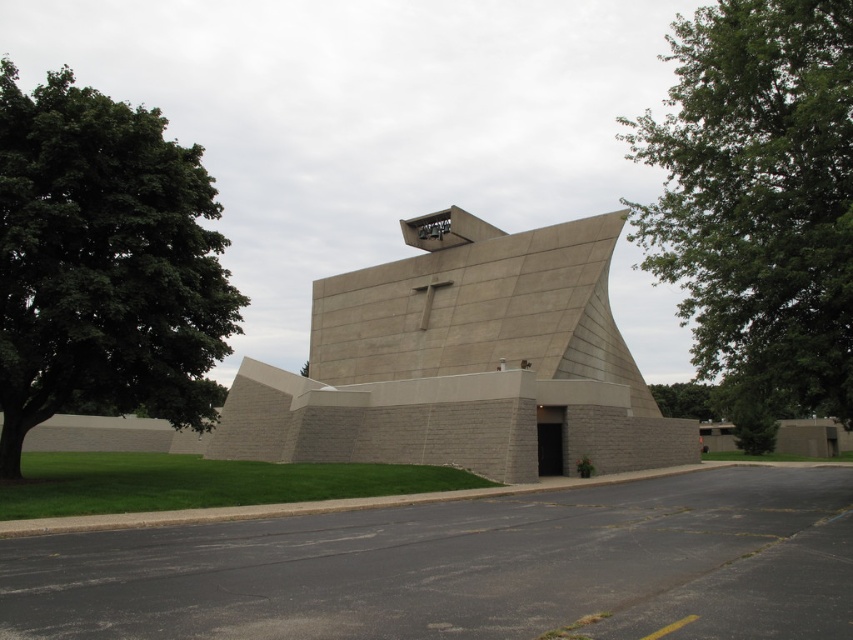
You are standing in front of the gray concrete church at center and the green leafy tree at left. Which object is taller?

The green leafy tree at left is taller than the gray concrete church at center.

Consider the image. You are an architect designing a new garden layout around the church. You need to place both green leafy tree at upper right and green leafy tree at lower right in the garden. Considering their sizes, which tree should be placed closer to the building to ensure proper spacing?

The green leafy tree at upper right has a larger width than the green leafy tree at lower right, so it should be placed closer to the building to accommodate its size and maintain proper spacing.